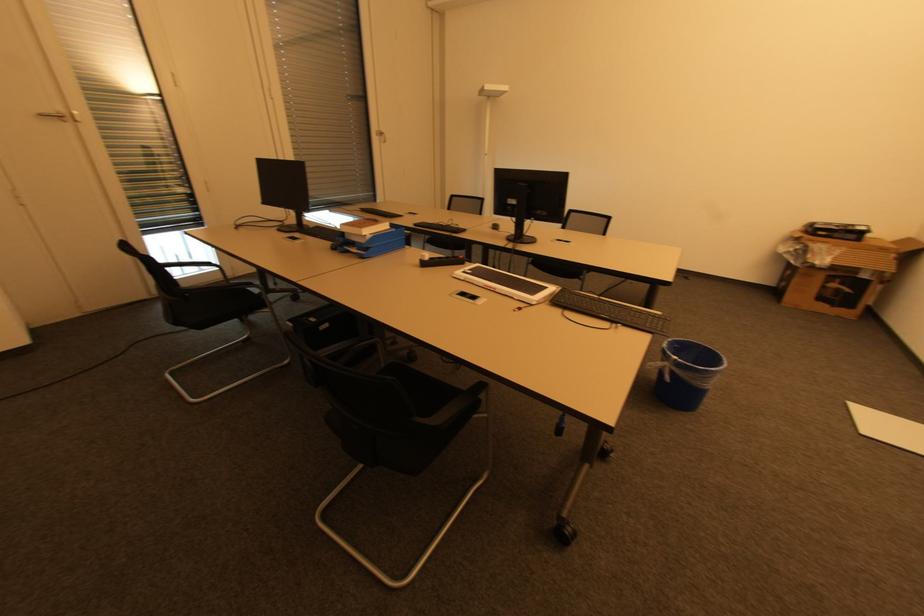
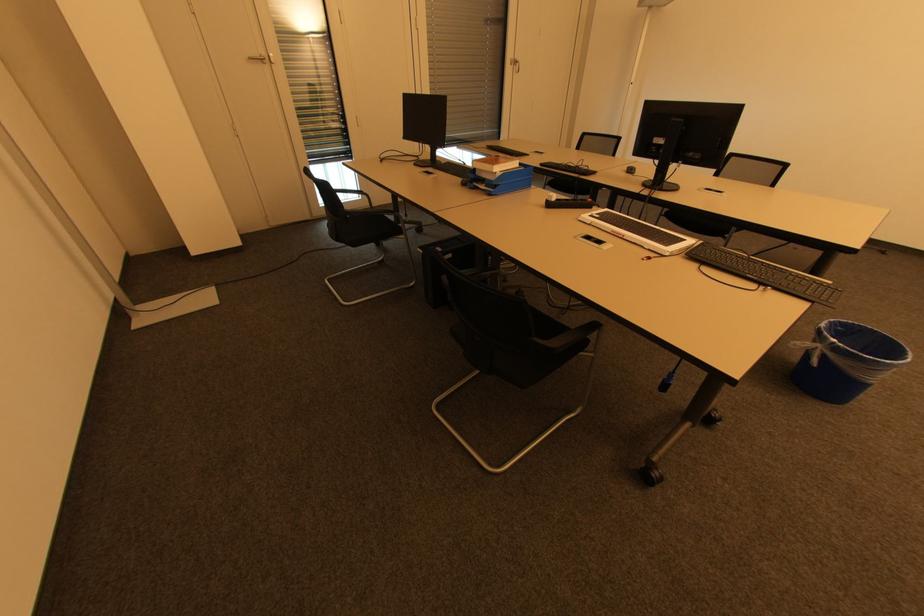
In the second image, find the point that corresponds to point 53,111 in the first image.

(258, 55)